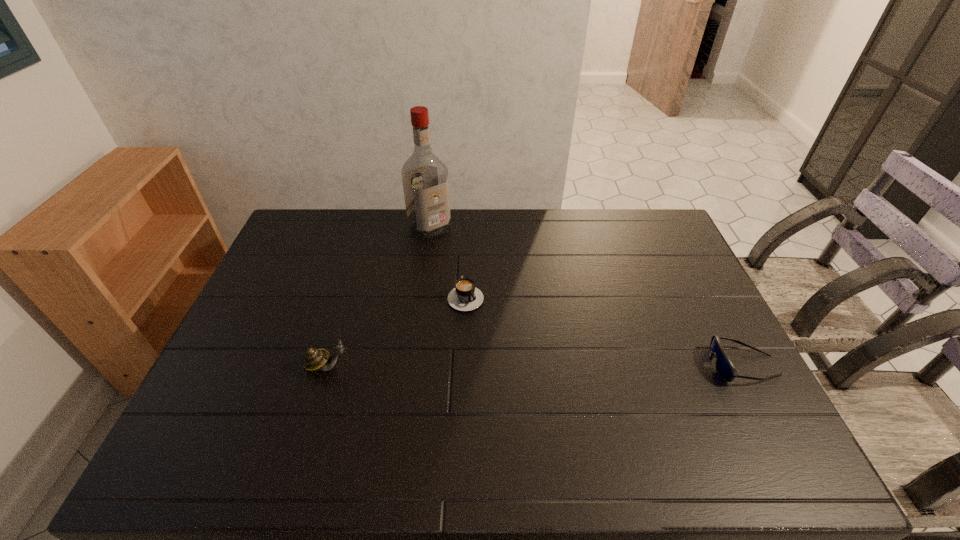
This screenshot has width=960, height=540. I want to click on vacant area that lies between the second tallest object and the liquor, so click(379, 297).

I want to click on empty space between the second tallest object and the cappuccino, so click(x=397, y=330).

Where is `free space between the cappuccino and the leftmost object`? This screenshot has width=960, height=540. free space between the cappuccino and the leftmost object is located at coordinates (397, 330).

The width and height of the screenshot is (960, 540). In order to click on free space that is in between the liquor and the leftmost object in this screenshot , I will do `click(379, 297)`.

Image resolution: width=960 pixels, height=540 pixels. I want to click on the second closest object relative to the third object from left to right, so click(315, 359).

Select which object is the closest to the rightmost object. Please provide its 2D coordinates. Your answer should be formatted as a tuple, i.e. [(x, y)], where the tuple contains the x and y coordinates of a point satisfying the conditions above.

[(465, 296)]